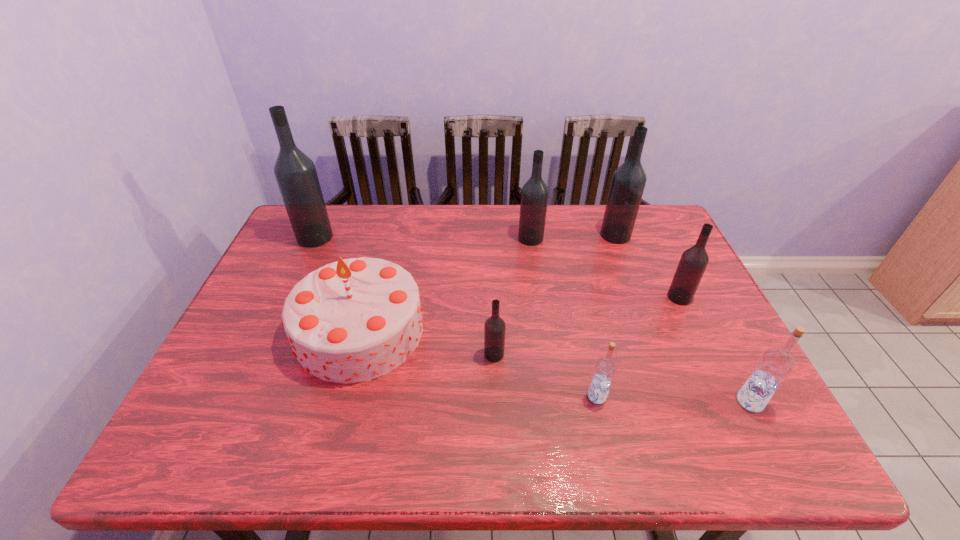
Where is `vacant space located 0.210m on the left of the third nearest vodka`? vacant space located 0.210m on the left of the third nearest vodka is located at coordinates (397, 354).

The image size is (960, 540). I want to click on free location located on the front of the smaller blue vodka, so click(x=610, y=453).

Identify the location of vodka located in the left edge section of the desktop. Image resolution: width=960 pixels, height=540 pixels. (295, 173).

Locate an element on the screen. birthday cake present at the left edge is located at coordinates (353, 320).

Identify the location of object located at the far left corner. This screenshot has height=540, width=960. (295, 173).

At what (x,y) coordinates should I click in order to perform the action: click on object that is at the far right corner. Please return your answer as a coordinate pair (x, y). Image resolution: width=960 pixels, height=540 pixels. Looking at the image, I should click on (628, 182).

In the image, there is a desktop. Identify the location of vacant space at the far edge. This screenshot has width=960, height=540. (550, 213).

The image size is (960, 540). I want to click on vacant space at the near edge of the desktop, so click(269, 449).

Image resolution: width=960 pixels, height=540 pixels. What are the coordinates of `vacant space at the left edge of the desktop` in the screenshot? It's located at (302, 271).

In the image, there is a desktop. Where is `vacant space at the near left corner`? The width and height of the screenshot is (960, 540). vacant space at the near left corner is located at coordinates (180, 434).